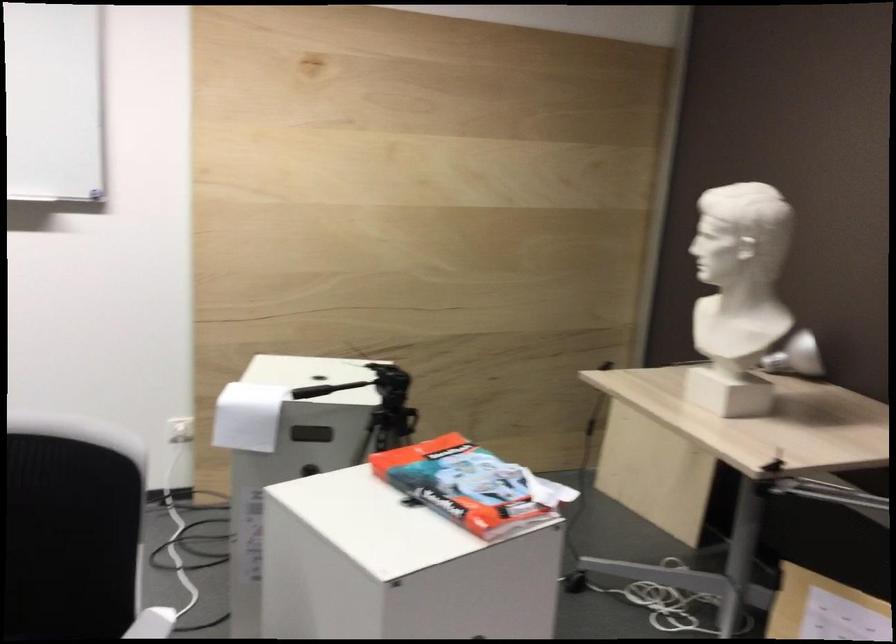
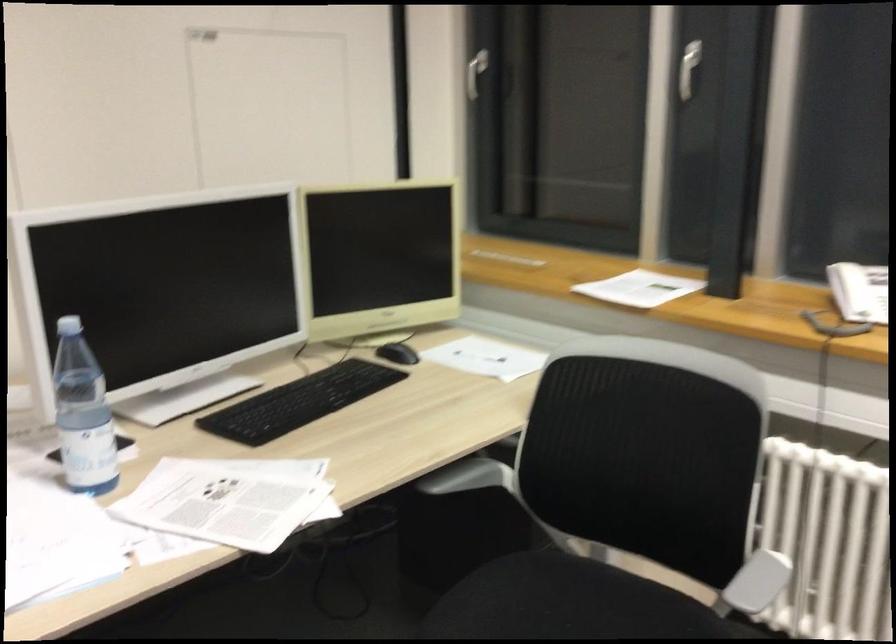
How did the camera likely rotate?

The rotation direction of the camera is right-down.